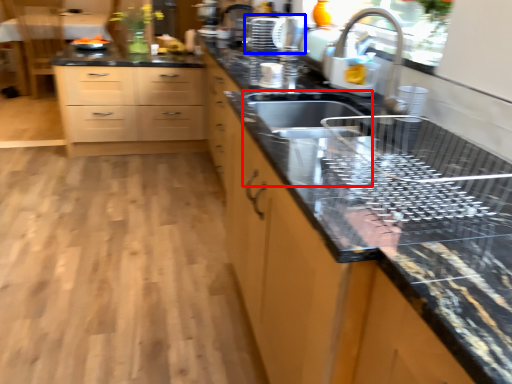
Question: Which point is further to the camera, sink (highlighted by a red box) or appliance (highlighted by a blue box)?

Choices:
 (A) sink
 (B) appliance

Answer: (B)